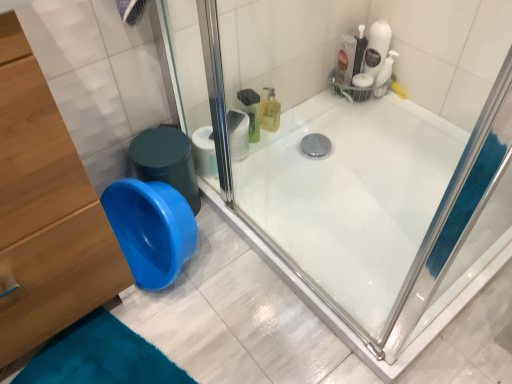
Question: Is the position of wooden dresser at left less distant than that of blue plastic potty at lower left?

Choices:
 (A) no
 (B) yes

Answer: (B)

Question: From the image's perspective, is wooden dresser at left above blue plastic potty at lower left?

Choices:
 (A) no
 (B) yes

Answer: (A)

Question: From a real-world perspective, is wooden dresser at left over blue plastic potty at lower left?

Choices:
 (A) yes
 (B) no

Answer: (A)

Question: Is wooden dresser at left outside of blue plastic potty at lower left?

Choices:
 (A) no
 (B) yes

Answer: (B)

Question: Can you confirm if wooden dresser at left is taller than blue plastic potty at lower left?

Choices:
 (A) no
 (B) yes

Answer: (B)

Question: In the image, is white matte toilet paper at upper center positioned in front of or behind wooden dresser at left?

Choices:
 (A) front
 (B) behind

Answer: (B)

Question: Based on their sizes in the image, would you say white matte toilet paper at upper center is bigger or smaller than wooden dresser at left?

Choices:
 (A) small
 (B) big

Answer: (A)

Question: From the image's perspective, is white matte toilet paper at upper center located above or below wooden dresser at left?

Choices:
 (A) above
 (B) below

Answer: (A)

Question: Is white matte toilet paper at upper center taller or shorter than wooden dresser at left?

Choices:
 (A) short
 (B) tall

Answer: (A)

Question: From the image's perspective, relative to wooden dresser at left, is blue plastic potty at lower left above or below?

Choices:
 (A) below
 (B) above

Answer: (B)

Question: In the image, is blue plastic potty at lower left on the left side or the right side of wooden dresser at left?

Choices:
 (A) left
 (B) right

Answer: (B)

Question: In the image, is blue plastic potty at lower left positioned in front of or behind wooden dresser at left?

Choices:
 (A) front
 (B) behind

Answer: (B)

Question: From their relative heights in the image, would you say blue plastic potty at lower left is taller or shorter than wooden dresser at left?

Choices:
 (A) tall
 (B) short

Answer: (B)

Question: Is point (111, 251) closer or farther from the camera than point (163, 130)?

Choices:
 (A) farther
 (B) closer

Answer: (B)

Question: Is wooden dresser at left bigger or smaller than blue plastic potty at lower left?

Choices:
 (A) big
 (B) small

Answer: (A)